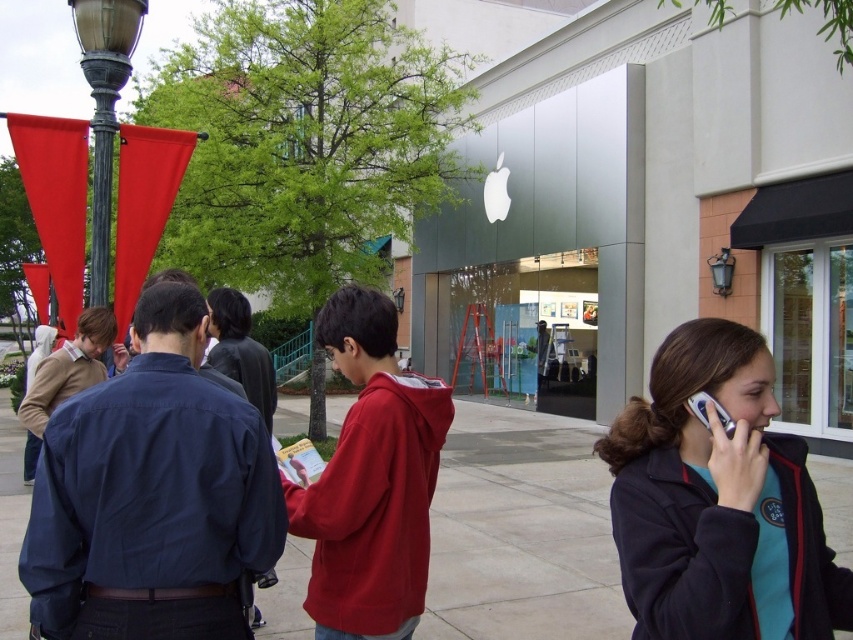
Does point (757, 484) come closer to viewer compared to point (352, 448)?

Yes.

Is point (788, 579) more distant than point (405, 605)?

No, it is not.

Where is `teal fleece jacket at lower right`? The width and height of the screenshot is (853, 640). teal fleece jacket at lower right is located at coordinates (714, 497).

Who is positioned more to the left, smooth concrete pavement at center or silver metallic phone at right?

From the viewer's perspective, smooth concrete pavement at center appears more on the left side.

In the scene shown: Which is more to the right, smooth concrete pavement at center or silver metallic phone at right?

Positioned to the right is silver metallic phone at right.

Where is `smooth concrete pavement at center`? The image size is (853, 640). smooth concrete pavement at center is located at coordinates (521, 531).

Describe the element at coordinates (521, 531) in the screenshot. The height and width of the screenshot is (640, 853). I see `smooth concrete pavement at center` at that location.

I want to click on smooth concrete pavement at center, so click(521, 531).

Is point (453, 490) in front of point (355, 508)?

No, (453, 490) is further to viewer.

Identify the location of smooth concrete pavement at center. (521, 531).